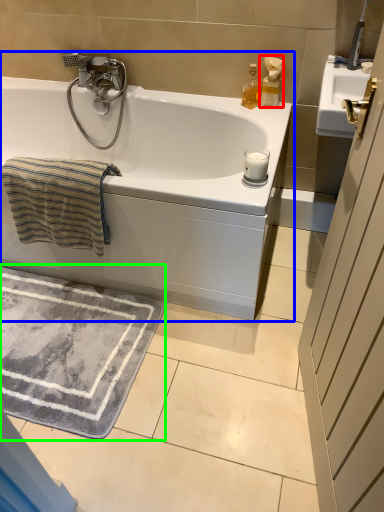
Question: Based on their relative distances, which object is nearer to soap dispenser (highlighted by a red box)? Choose from bathtub (highlighted by a blue box) and bath mat (highlighted by a green box).

Choices:
 (A) bathtub
 (B) bath mat

Answer: (A)